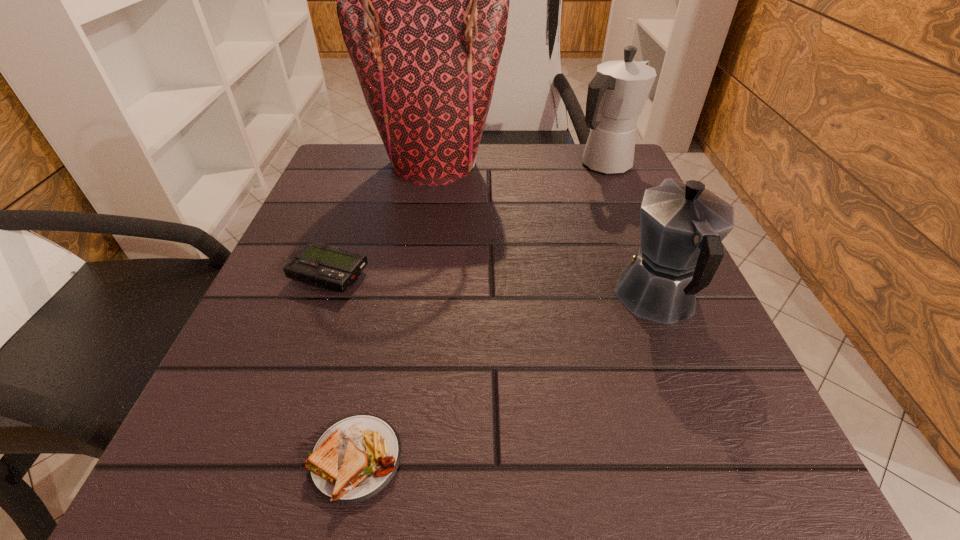
At what (x,y) coordinates should I click in order to perform the action: click on free space between the third tallest object and the fourth tallest object. Please return your answer as a coordinate pair (x, y). The height and width of the screenshot is (540, 960). Looking at the image, I should click on (493, 287).

Select which object appears as the third closest to the second shortest object. Please provide its 2D coordinates. Your answer should be formatted as a tuple, i.e. [(x, y)], where the tuple contains the x and y coordinates of a point satisfying the conditions above.

[(682, 226)]

Where is `object that ranks as the second closest to the nearest object`? Image resolution: width=960 pixels, height=540 pixels. object that ranks as the second closest to the nearest object is located at coordinates (682, 226).

Find the location of `free space that satisfies the following two spatial constraints: 1. on the back side of the farther coffeepot; 2. on the left side of the shortest object`. free space that satisfies the following two spatial constraints: 1. on the back side of the farther coffeepot; 2. on the left side of the shortest object is located at coordinates (418, 166).

At what (x,y) coordinates should I click in order to perform the action: click on vacant point that satisfies the following two spatial constraints: 1. on the front side of the handbag; 2. on the right side of the fourth shortest object. Please return your answer as a coordinate pair (x, y). Looking at the image, I should click on (434, 166).

Identify the location of vacant space that satisfies the following two spatial constraints: 1. on the front side of the sandwich; 2. on the left side of the fourth tallest object. This screenshot has width=960, height=540. (262, 459).